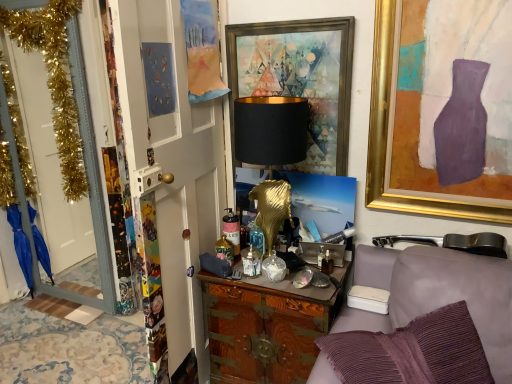
This screenshot has width=512, height=384. I want to click on blank space situated above wooden cabinet at center (from a real-world perspective), so click(x=270, y=265).